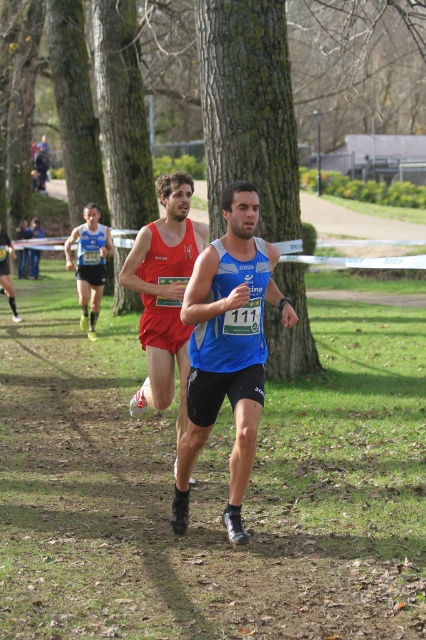
Is point (287, 332) positioned behind point (111, 241)?

No.

Which is above, green mossy tree at center or matte red singlet at left?

matte red singlet at left is above.

Between point (278, 26) and point (80, 252), which one is positioned behind?

Positioned behind is point (80, 252).

Locate an element on the screen. green mossy tree at center is located at coordinates (249, 109).

Find the location of `green mossy tree at center`. green mossy tree at center is located at coordinates (249, 109).

Who is positioned more to the left, matte blue tank top at center or matte red singlet at center?

matte red singlet at center is more to the left.

Measure the distance between matte blue tank top at center and camera.

matte blue tank top at center is 18.51 feet from camera.

I want to click on matte blue tank top at center, so click(227, 348).